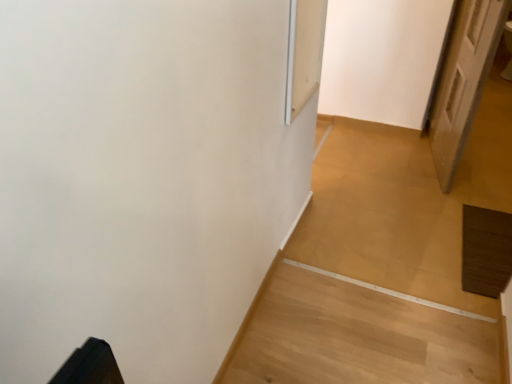
This screenshot has width=512, height=384. In order to click on transparent glass screen door at upper center in this screenshot , I will do `click(304, 53)`.

The image size is (512, 384). What do you see at coordinates (304, 53) in the screenshot? I see `transparent glass screen door at upper center` at bounding box center [304, 53].

Measure the distance between white wooden door at right and camera.

The depth of white wooden door at right is 1.74 meters.

Describe the element at coordinates (464, 80) in the screenshot. I see `white wooden door at right` at that location.

Where is `white wooden door at right`? The height and width of the screenshot is (384, 512). white wooden door at right is located at coordinates (464, 80).

The height and width of the screenshot is (384, 512). What are the coordinates of `transparent glass screen door at upper center` in the screenshot? It's located at (304, 53).

Considering the relative positions of white wooden door at right and transparent glass screen door at upper center in the image provided, is white wooden door at right to the left of transparent glass screen door at upper center from the viewer's perspective?

No, white wooden door at right is not to the left of transparent glass screen door at upper center.

Is the depth of white wooden door at right less than that of transparent glass screen door at upper center?

No, white wooden door at right is further to the viewer.

Is point (465, 92) less distant than point (322, 42)?

No, (465, 92) is behind (322, 42).

From the image's perspective, which one is positioned lower, white wooden door at right or transparent glass screen door at upper center?

transparent glass screen door at upper center is shown below in the image.

From a real-world perspective, which is physically above, white wooden door at right or transparent glass screen door at upper center?

transparent glass screen door at upper center is physically above.

Considering the sizes of objects white wooden door at right and transparent glass screen door at upper center in the image provided, who is thinner, white wooden door at right or transparent glass screen door at upper center?

transparent glass screen door at upper center.

Is white wooden door at right taller or shorter than transparent glass screen door at upper center?

In the image, white wooden door at right appears to be taller than transparent glass screen door at upper center.

Consider the image. Considering the relative sizes of white wooden door at right and transparent glass screen door at upper center in the image provided, is white wooden door at right smaller than transparent glass screen door at upper center?

Incorrect, white wooden door at right is not smaller in size than transparent glass screen door at upper center.

Is white wooden door at right outside of transparent glass screen door at upper center?

Yes, white wooden door at right is located beyond the bounds of transparent glass screen door at upper center.

Is white wooden door at right not close to transparent glass screen door at upper center?

They are positioned close to each other.

Is transparent glass screen door at upper center at the back of white wooden door at right?

No, white wooden door at right is not facing the opposite direction of transparent glass screen door at upper center.

How much distance is there between white wooden door at right and transparent glass screen door at upper center?

The distance of white wooden door at right from transparent glass screen door at upper center is 93.49 centimeters.

Find the location of `door behind the transparent glass screen door at upper center`. door behind the transparent glass screen door at upper center is located at coordinates (464, 80).

Between transparent glass screen door at upper center and white wooden door at right, which one appears on the right side from the viewer's perspective?

white wooden door at right is more to the right.

Is transparent glass screen door at upper center further to the viewer compared to white wooden door at right?

No, it is not.

Considering the points (298, 98) and (489, 69), which point is in front, point (298, 98) or point (489, 69)?

The point (298, 98) is closer to the camera.

From the image's perspective, is transparent glass screen door at upper center above white wooden door at right?

Incorrect, from the image's perspective, transparent glass screen door at upper center is lower than white wooden door at right.

From a real-world perspective, between transparent glass screen door at upper center and white wooden door at right, who is vertically higher?

transparent glass screen door at upper center.

Is transparent glass screen door at upper center wider than white wooden door at right?

In fact, transparent glass screen door at upper center might be narrower than white wooden door at right.

Considering the relative sizes of transparent glass screen door at upper center and white wooden door at right in the image provided, is transparent glass screen door at upper center shorter than white wooden door at right?

Yes.

Does transparent glass screen door at upper center have a smaller size compared to white wooden door at right?

Yes.

Is transparent glass screen door at upper center located outside white wooden door at right?

transparent glass screen door at upper center lies outside white wooden door at right's area.

Is transparent glass screen door at upper center touching white wooden door at right?

No, transparent glass screen door at upper center is not beside white wooden door at right.

Is transparent glass screen door at upper center positioned with its back to white wooden door at right?

transparent glass screen door at upper center is not turned away from white wooden door at right.

How many degrees apart are the facing directions of transparent glass screen door at upper center and white wooden door at right?

There is a 10.9-degree angle between the facing directions of transparent glass screen door at upper center and white wooden door at right.

Find the location of a particular element. door on the right of transparent glass screen door at upper center is located at coordinates pos(464,80).

Locate an element on the screen. The width and height of the screenshot is (512, 384). screen door in front of the white wooden door at right is located at coordinates (304, 53).

There is a white wooden door at right. Where is `screen door above it (from a real-world perspective)`? screen door above it (from a real-world perspective) is located at coordinates (304, 53).